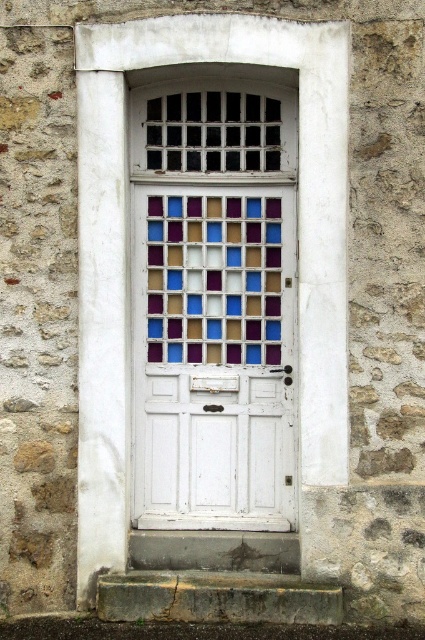
Question: Can you confirm if white painted wood at center is positioned above stained glass window at center?

Choices:
 (A) no
 (B) yes

Answer: (A)

Question: Considering the real-world distances, which object is closest to the white painted wood at center?

Choices:
 (A) white painted wood door at center
 (B) stained glass window at center

Answer: (A)

Question: Can you confirm if white painted wood door at center is positioned below stained glass window at center?

Choices:
 (A) yes
 (B) no

Answer: (A)

Question: Which point is closer to the camera taking this photo?

Choices:
 (A) (212, 493)
 (B) (269, 317)
 (C) (345, 456)

Answer: (C)

Question: Is white painted wood door at center smaller than stained glass window at center?

Choices:
 (A) no
 (B) yes

Answer: (A)

Question: Which is nearer to the white painted wood door at center?

Choices:
 (A) stained glass window at center
 (B) white painted wood at center

Answer: (A)